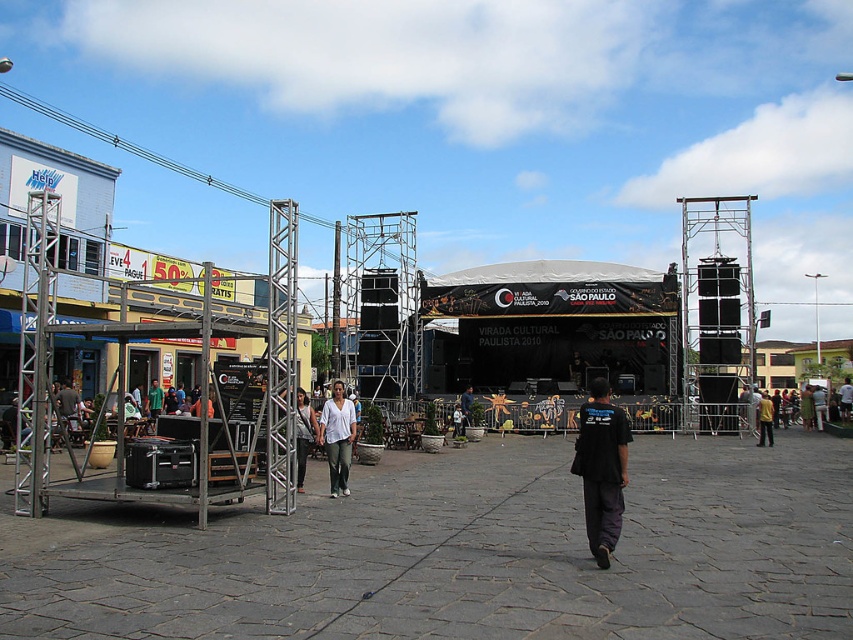
You are standing at the point marked as point (x=337, y=436) in the image. What is the color of the clothing item you are currently wearing at that location?

Result: The point (x=337, y=436) is on white cotton shirt at center, so the color of the clothing item at that location is white.

You are a stagehand carrying a heavy equipment box and need to move from the denim jacket at center to the dark blue jeans at center. Given that the equipment box is 14 meters long, can you safely maneuver it through the space between them without hitting anything?

The distance between the denim jacket at center and dark blue jeans at center is 13.21 meters. Since the equipment box is 14 meters long, it is longer than the available space. Therefore, you cannot safely maneuver it through the space between them without risking a collision.